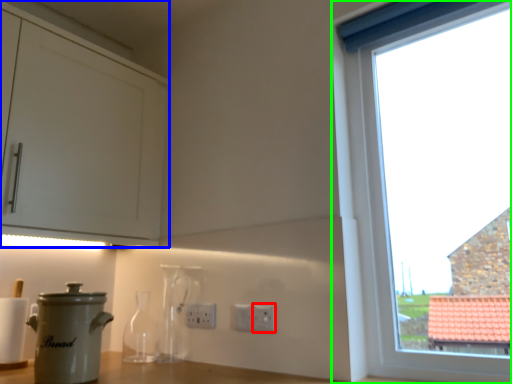
Question: Considering the real-world distances, which object is farthest from electric outlet (highlighted by a red box)? cabinetry (highlighted by a blue box) or window (highlighted by a green box)?

Choices:
 (A) cabinetry
 (B) window

Answer: (A)